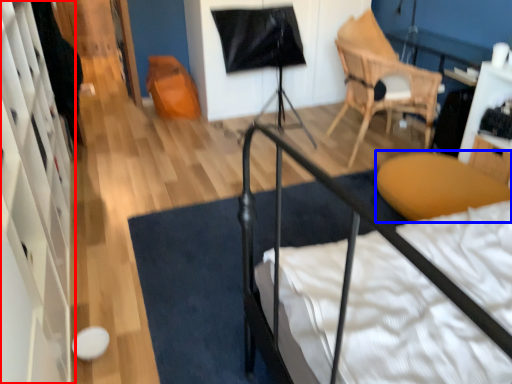
Question: Which of the following is the farthest to the observer, dresser (highlighted by a red box) or furniture (highlighted by a blue box)?

Choices:
 (A) dresser
 (B) furniture

Answer: (B)